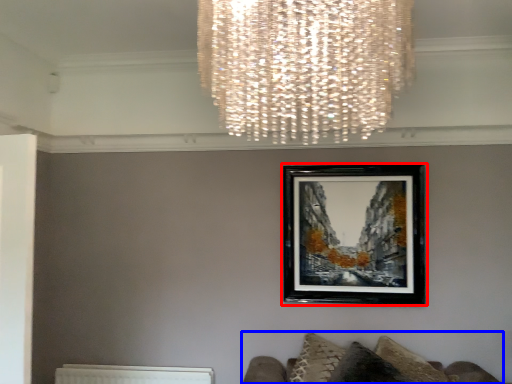
Question: Which point is closer to the camera, picture frame (highlighted by a red box) or furniture (highlighted by a blue box)?

Choices:
 (A) picture frame
 (B) furniture

Answer: (B)